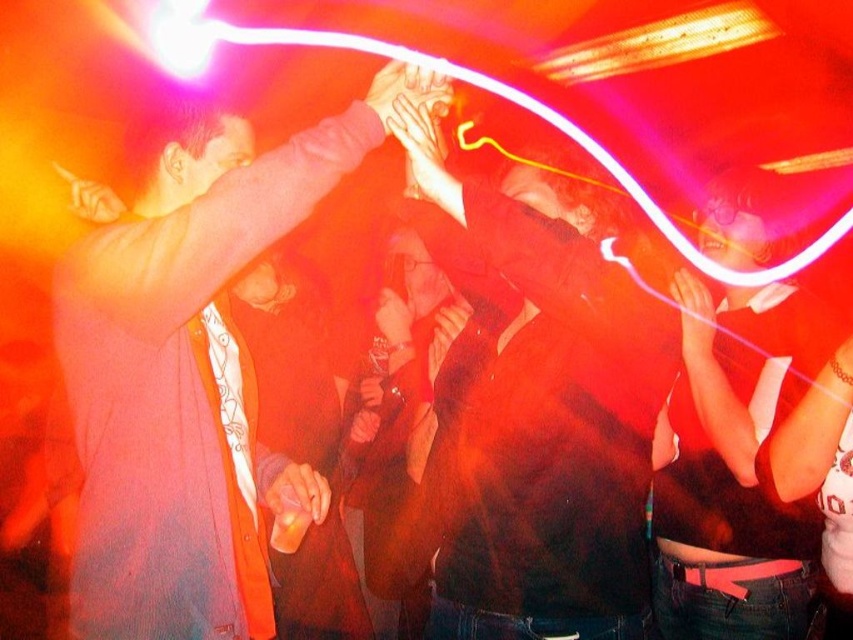
Based on the photo, you are at a party and want to hand a drink to both the person wearing the matte pink sweater at upper left and the person wearing the dark brown leather jacket at center. Which person should you approach first to ensure you can reach them without moving too far from your current position?

You should approach the matte pink sweater at upper left first because it is closer to you than the dark brown leather jacket at center, so you can reach them without moving as much.

You are at a party and want to find a specific item. Where exactly is the matte pink sweater at upper left located in the image?

The matte pink sweater at upper left is located at point (193, 378) in the image.

Consider the image. You are at a party with two points marked in the image. The first point is at coordinate point (253, 428) and the second is at coordinate point (593, 515). Which point is closer to you?

Point (593, 515) is closer to you because point (253, 428) is behind it.